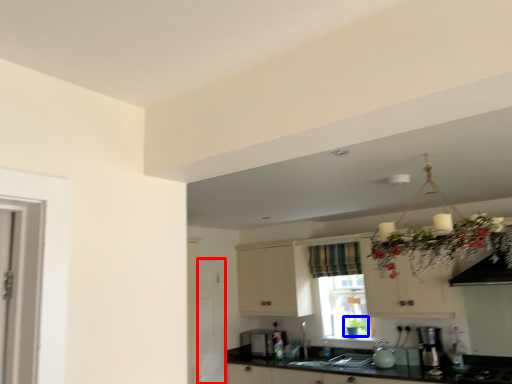
Question: Among these objects, which one is nearest to the camera, screen door (highlighted by a red box) or plant (highlighted by a blue box)?

Choices:
 (A) screen door
 (B) plant

Answer: (A)